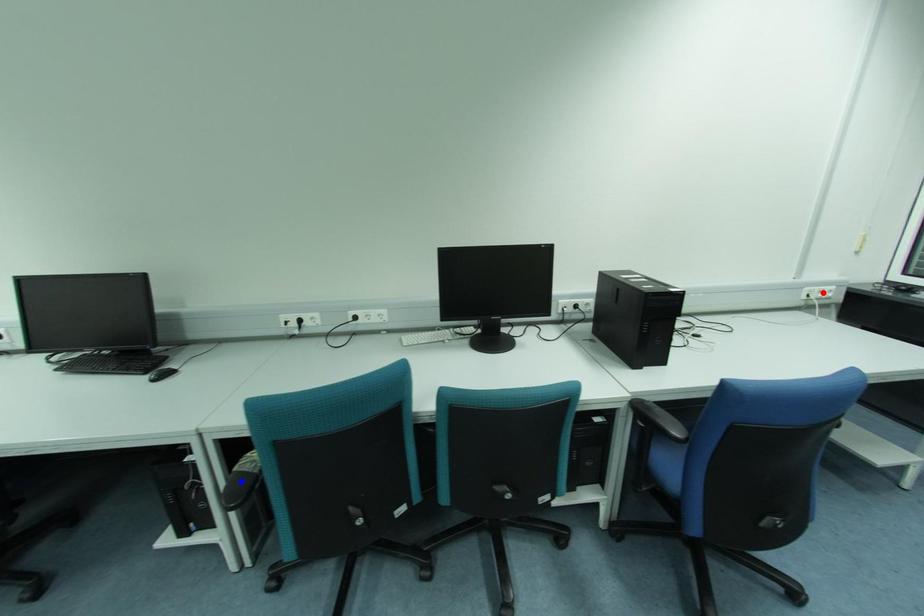
Question: Two points are marked on the image. Which point is closer to the camera?

Choices:
 (A) Blue point is closer.
 (B) Red point is closer.

Answer: (A)